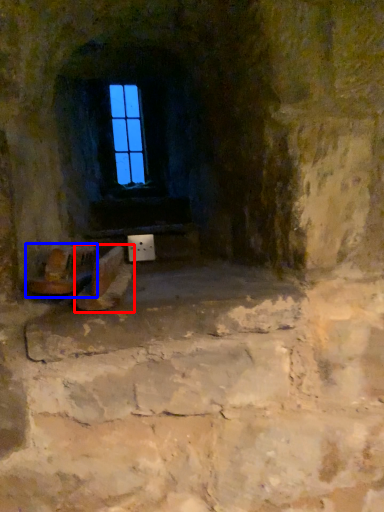
Question: Which object appears farthest to the camera in this image, footwear (highlighted by a red box) or chair (highlighted by a blue box)?

Choices:
 (A) footwear
 (B) chair

Answer: (B)